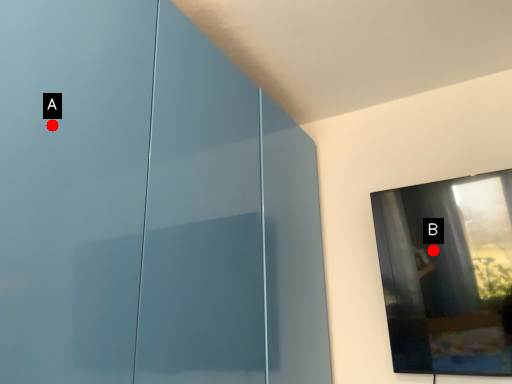
Question: Two points are circled on the image, labeled by A and B beside each circle. Which point appears closest to the camera in this image?

Choices:
 (A) A is closer
 (B) B is closer

Answer: (A)